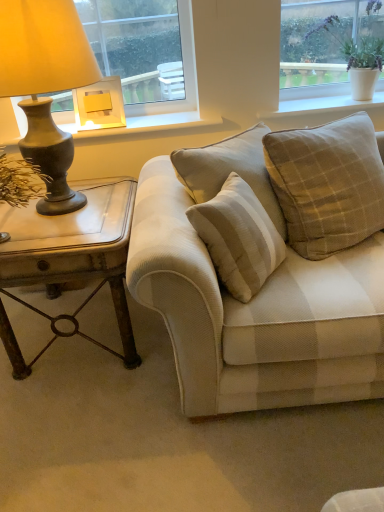
Where is `empty space that is ontop of rustic wood side table at left (from a real-world perspective)`? empty space that is ontop of rustic wood side table at left (from a real-world perspective) is located at coordinates (57, 219).